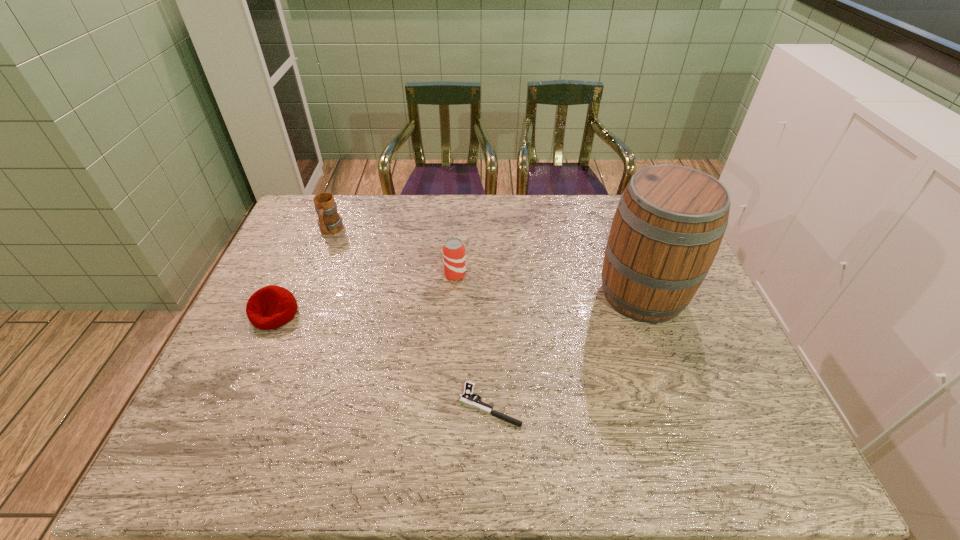
Find the location of a particular element. This screenshot has width=960, height=540. vacant position located 0.180m on the seat area of the beanbag is located at coordinates (241, 390).

Where is `free space located 0.240m on the front-facing side of the shortest object`? free space located 0.240m on the front-facing side of the shortest object is located at coordinates (356, 405).

Where is `free space located 0.350m on the front-facing side of the shortest object`? This screenshot has width=960, height=540. free space located 0.350m on the front-facing side of the shortest object is located at coordinates (308, 405).

Locate an element on the screen. vacant space located 0.320m on the front-facing side of the shortest object is located at coordinates point(322,405).

What are the coordinates of `object at the far edge` in the screenshot? It's located at (329, 221).

At what (x,y) coordinates should I click in order to perform the action: click on mug present at the left edge. Please return your answer as a coordinate pair (x, y). Image resolution: width=960 pixels, height=540 pixels. Looking at the image, I should click on pos(329,221).

This screenshot has width=960, height=540. Find the location of `beanbag positioned at the left edge`. beanbag positioned at the left edge is located at coordinates (271, 307).

Identify the location of object located at the right edge. The image size is (960, 540). (670, 221).

Locate an element on the screen. Image resolution: width=960 pixels, height=540 pixels. object positioned at the far left corner is located at coordinates (329, 221).

In the image, there is a desktop. What are the coordinates of `free region at the far edge` in the screenshot? It's located at (508, 222).